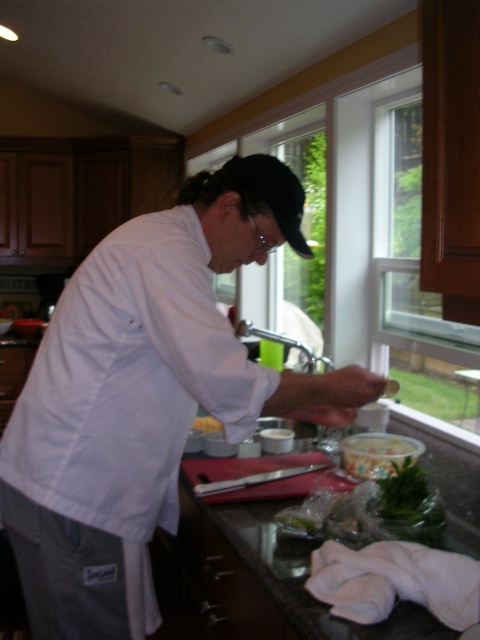
Can you confirm if white fabric chef at center is smaller than smooth plastic container at lower center?

No.

Does white fabric chef at center lie behind smooth plastic container at lower center?

That is False.

Find the location of a particular element. The image size is (480, 640). white fabric chef at center is located at coordinates (145, 396).

Which is in front, point (189, 480) or point (202, 426)?

Positioned in front is point (189, 480).

Who is shorter, smooth granite countertop at center or yellow matte butter at center?

yellow matte butter at center

Between point (265, 545) and point (195, 428), which one is positioned behind?

Positioned behind is point (195, 428).

Identify the location of smooth granite countertop at center. (276, 573).

Who is positioned more to the left, white fabric chef at center or smooth granite countertop at center?

Positioned to the left is white fabric chef at center.

Is white fabric chef at center smaller than smooth granite countertop at center?

Actually, white fabric chef at center might be larger than smooth granite countertop at center.

Which is behind, point (95, 330) or point (284, 588)?

The point (95, 330) is more distant.

You are a GUI agent. You are given a task and a screenshot of the screen. Output one action in this format:
    pyautogui.click(x=<x>, y=<y>)
    Task: Click on the white fabric chef at center
    This screenshot has width=480, height=640.
    Given the screenshot: What is the action you would take?
    pyautogui.click(x=145, y=396)